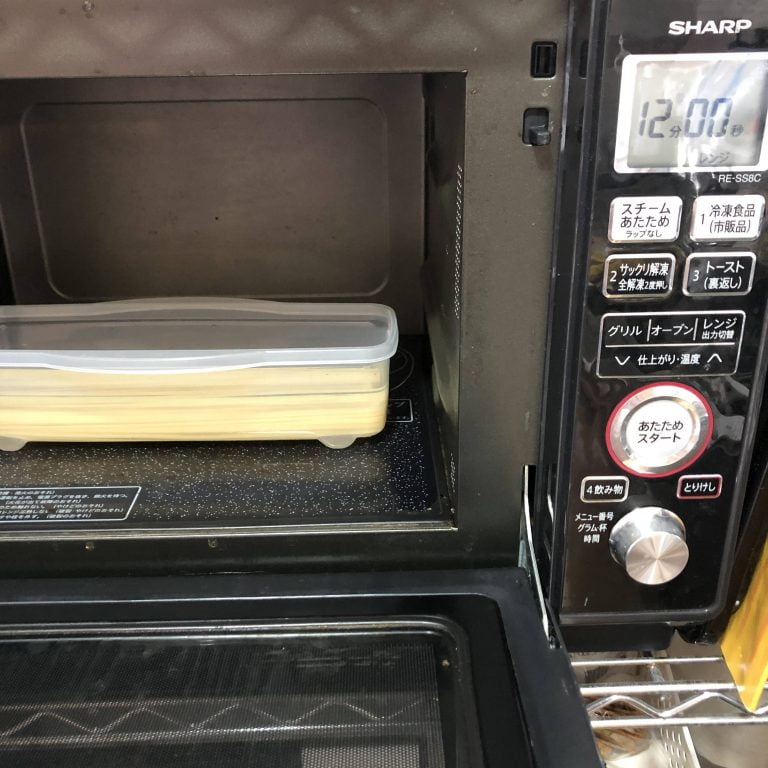
The image size is (768, 768). I want to click on oven manufacturer's label, so click(x=21, y=505), click(x=93, y=501).